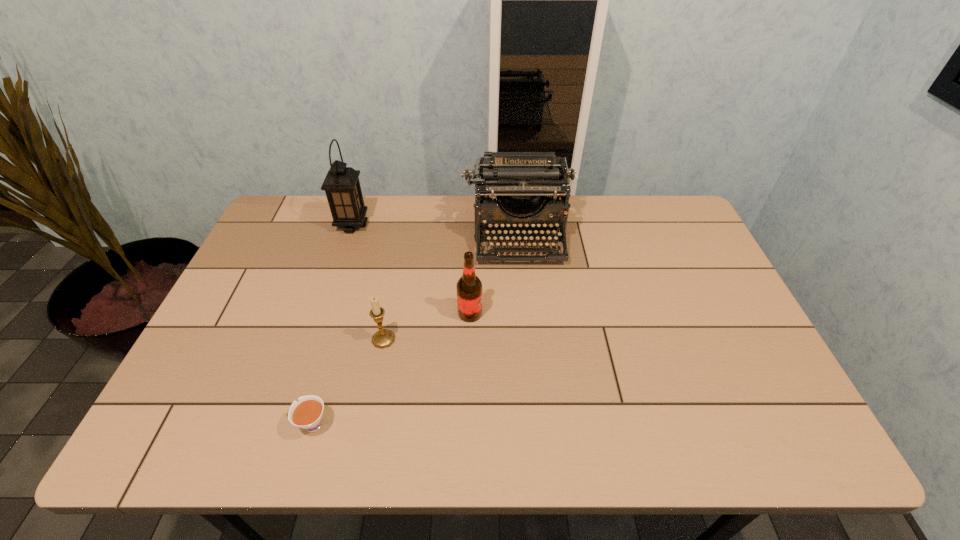
You are a GUI agent. You are given a task and a screenshot of the screen. Output one action in this format:
    pyautogui.click(x=<x>, y=<y>)
    Task: Click on the lantern
    The image size is (960, 540).
    Given the screenshot: What is the action you would take?
    pyautogui.click(x=342, y=187)

Find the location of a particular element. The height and width of the screenshot is (540, 960). typewriter is located at coordinates (515, 183).

At what (x,y) coordinates should I click in order to perform the action: click on the third farthest object. Please return your answer as a coordinate pair (x, y). This screenshot has width=960, height=540. Looking at the image, I should click on (469, 287).

Find the location of a particular element. candle holder is located at coordinates (384, 338).

Find the location of a particular element. Image resolution: width=960 pixels, height=540 pixels. the fourth tallest object is located at coordinates (384, 338).

This screenshot has width=960, height=540. Identify the location of the shortest object. (307, 413).

I want to click on the nearest object, so click(x=307, y=413).

Locate an element on the screen. The image size is (960, 540). free space located on the right of the tallest object is located at coordinates (430, 225).

I want to click on free region located on the typing side of the typewriter, so click(x=527, y=329).

You are a GUI agent. You are given a task and a screenshot of the screen. Output one action in this format:
    pyautogui.click(x=<x>, y=<y>)
    Task: Click on the free space located on the front of the third farthest object
    Image resolution: width=960 pixels, height=540 pixels.
    Given the screenshot: What is the action you would take?
    pyautogui.click(x=469, y=350)